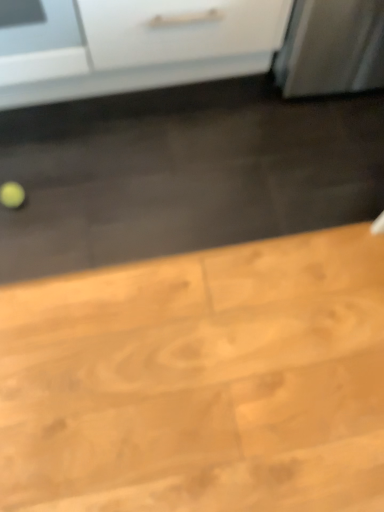
Question: Is point (216, 472) closer or farther from the camera than point (43, 2)?

Choices:
 (A) closer
 (B) farther

Answer: (A)

Question: In terms of width, does wooden table at lower left look wider or thinner when compared to white glossy refrigerator at upper left?

Choices:
 (A) thin
 (B) wide

Answer: (B)

Question: From a real-world perspective, is wooden table at lower left above or below white glossy refrigerator at upper left?

Choices:
 (A) above
 (B) below

Answer: (B)

Question: Is point (48, 77) closer or farther from the camera than point (41, 333)?

Choices:
 (A) farther
 (B) closer

Answer: (A)

Question: Which is correct: white glossy refrigerator at upper left is inside wooden table at lower left, or outside of it?

Choices:
 (A) outside
 (B) inside

Answer: (A)

Question: Considering the relative positions of white glossy refrigerator at upper left and wooden table at lower left in the image provided, is white glossy refrigerator at upper left to the left or to the right of wooden table at lower left?

Choices:
 (A) left
 (B) right

Answer: (A)

Question: From the image's perspective, relative to wooden table at lower left, is white glossy refrigerator at upper left above or below?

Choices:
 (A) above
 (B) below

Answer: (A)